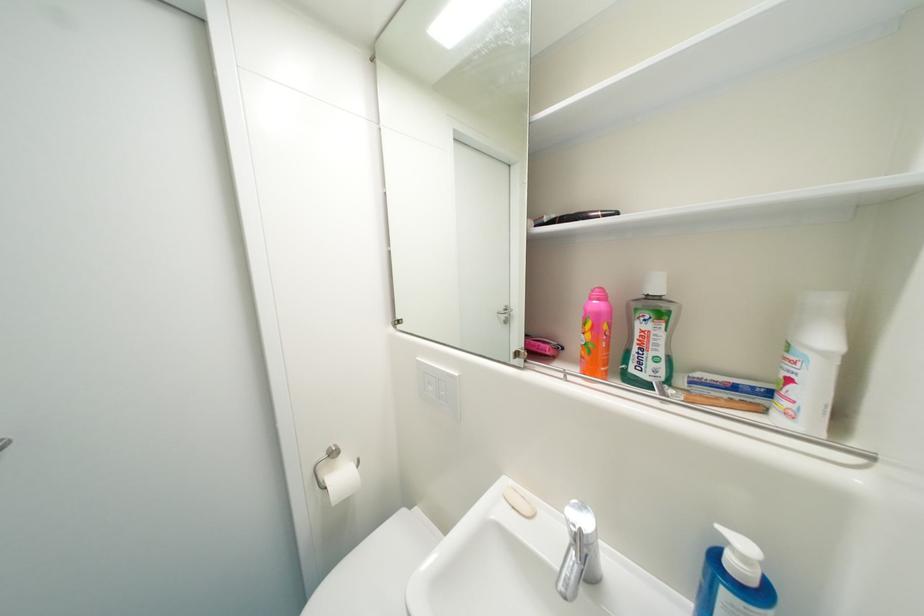
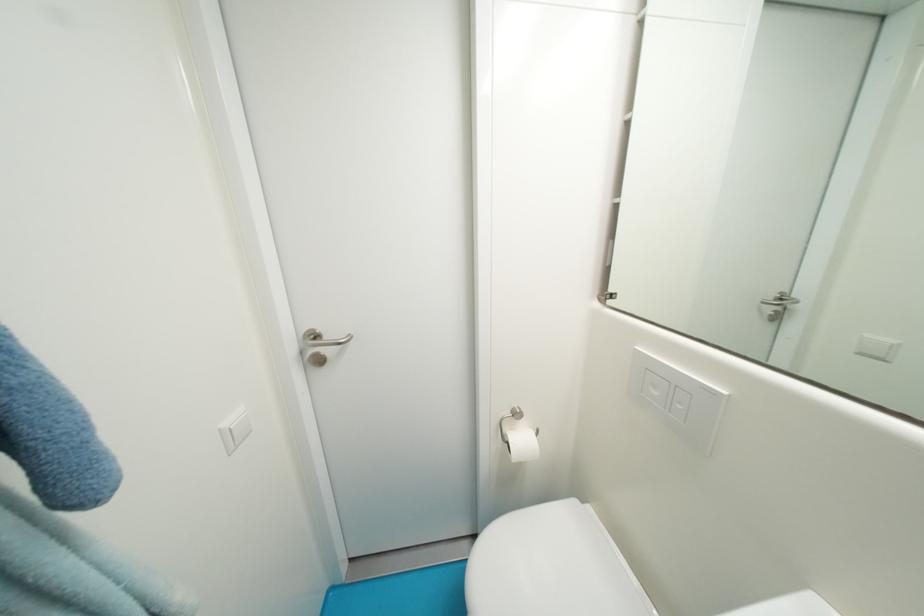
Question: The camera is either moving clockwise (left) or counter-clockwise (right) around the object. The first image is from the beginning of the video and the second image is from the end. Is the camera moving left or right when shooting the video?

Choices:
 (A) Left
 (B) Right

Answer: (B)